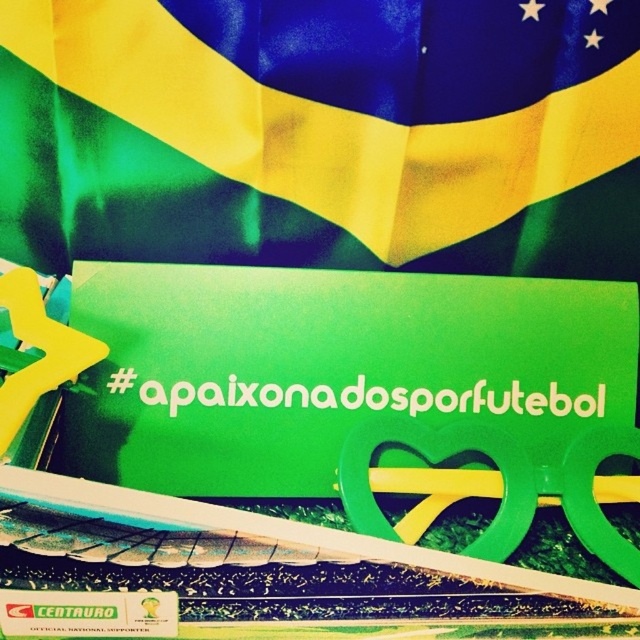
Question: Is green fabric flag at upper center smaller than green matte sign at center?

Choices:
 (A) no
 (B) yes

Answer: (A)

Question: Can you confirm if green fabric flag at upper center is positioned below green matte sign at center?

Choices:
 (A) yes
 (B) no

Answer: (B)

Question: Which point is closer to the camera taking this photo?

Choices:
 (A) (177, 257)
 (B) (120, 305)

Answer: (B)

Question: Which of the following is the closest to the observer?

Choices:
 (A) green matte sign at center
 (B) green fabric flag at upper center

Answer: (B)

Question: In this image, where is green fabric flag at upper center located relative to green matte sign at center?

Choices:
 (A) above
 (B) below

Answer: (A)